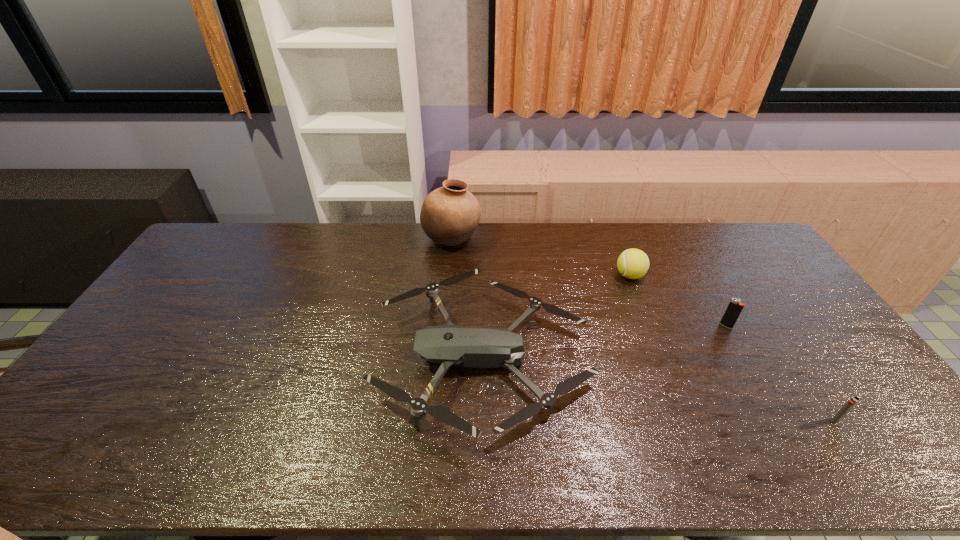
Where is `vacant region between the farthest object and the farther igniter`? The height and width of the screenshot is (540, 960). vacant region between the farthest object and the farther igniter is located at coordinates coord(588,282).

I want to click on empty space between the farther igniter and the drone, so click(605, 342).

Locate an element on the screen. vacant area that lies between the drone and the fourth nearest object is located at coordinates (557, 316).

The height and width of the screenshot is (540, 960). I want to click on free point between the tennis ball and the fourth object from left to right, so click(x=678, y=301).

Find the location of a particular element. This screenshot has height=540, width=960. free space between the second object from right to left and the tennis ball is located at coordinates (678, 301).

Locate an element on the screen. This screenshot has width=960, height=540. object that stands as the third closest to the second object from right to left is located at coordinates (471, 347).

The image size is (960, 540). What are the coordinates of `object that stands as the closest to the tennis ball` in the screenshot? It's located at (471, 347).

Identify the location of free point that satisfies the following two spatial constraints: 1. on the front side of the taller igniter; 2. with a camera mounted on the front of the drone. The width and height of the screenshot is (960, 540). (744, 357).